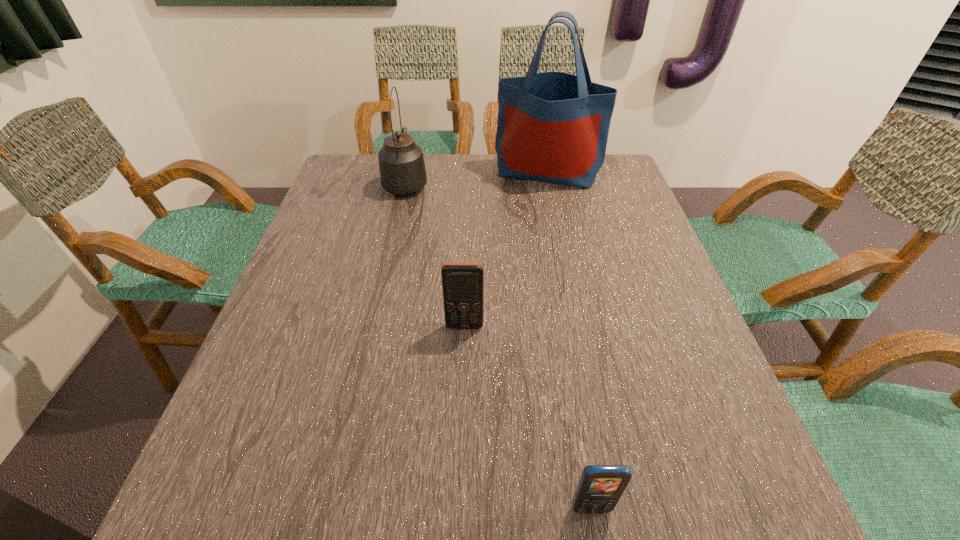
This screenshot has height=540, width=960. Find the location of `vacant area between the kettle and the right cellular telephone`. vacant area between the kettle and the right cellular telephone is located at coordinates [x=498, y=346].

At what (x,y) coordinates should I click in order to perform the action: click on blank region between the tallest object and the kettle. Please return your answer as a coordinate pair (x, y). Looking at the image, I should click on (476, 177).

I want to click on unoccupied area between the handbag and the shorter cellular telephone, so click(x=568, y=340).

Identify which object is the third closest to the taller cellular telephone. Please provide its 2D coordinates. Your answer should be formatted as a tuple, i.e. [(x, y)], where the tuple contains the x and y coordinates of a point satisfying the conditions above.

[(552, 127)]

Where is `object that is the nearest to the tallest object`? The width and height of the screenshot is (960, 540). object that is the nearest to the tallest object is located at coordinates (402, 169).

Where is `vacant position in the image that satisfies the following two spatial constraints: 1. spout on the tallest object; 2. on the right side of the leftmost object`? This screenshot has height=540, width=960. vacant position in the image that satisfies the following two spatial constraints: 1. spout on the tallest object; 2. on the right side of the leftmost object is located at coordinates (408, 172).

Find the location of a particular element. free space that satisfies the following two spatial constraints: 1. spout on the kettle; 2. on the left side of the handbag is located at coordinates (408, 172).

The image size is (960, 540). In order to click on free space that satisfies the following two spatial constraints: 1. spout on the handbag; 2. on the right side of the kettle in this screenshot , I will do `click(408, 172)`.

Image resolution: width=960 pixels, height=540 pixels. In order to click on blank space that satisfies the following two spatial constraints: 1. spout on the tallest object; 2. on the left side of the third shortest object in this screenshot , I will do `click(408, 172)`.